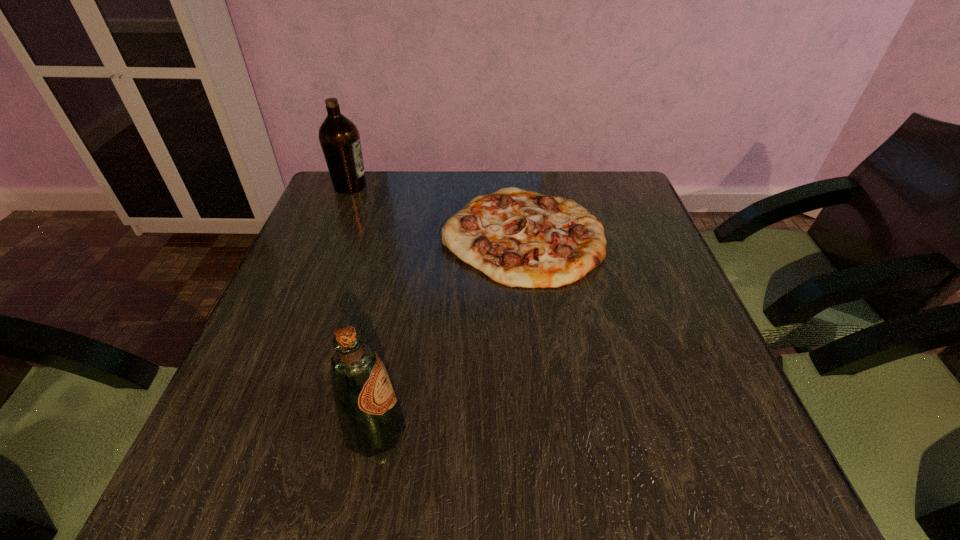
Image resolution: width=960 pixels, height=540 pixels. In the image, there is a desktop. Identify the location of free space at the far left corner. (336, 205).

The image size is (960, 540). In the image, there is a desktop. In order to click on free region at the far right corner in this screenshot , I will do (589, 188).

Locate an element on the screen. This screenshot has width=960, height=540. vacant space at the near right corner is located at coordinates (683, 467).

This screenshot has height=540, width=960. Identify the location of free space between the shortest object and the right olive oil. (449, 333).

This screenshot has width=960, height=540. Identify the location of vacant region between the second object from right to left and the pizza. (449, 333).

You are a GUI agent. You are given a task and a screenshot of the screen. Output one action in this format:
    pyautogui.click(x=<x>, y=<y>)
    Task: Click on the free space that is in between the shortest object and the right olive oil
    This screenshot has height=540, width=960.
    Given the screenshot: What is the action you would take?
    pyautogui.click(x=449, y=333)

The width and height of the screenshot is (960, 540). Identify the location of free spot between the right olive oil and the leftmost object. (363, 308).

Identify the location of free space between the farther olive oil and the shortest object. The width and height of the screenshot is (960, 540). (437, 210).

Find the location of a particular element. The width and height of the screenshot is (960, 540). free space that is in between the second object from left to right and the rightmost object is located at coordinates click(x=449, y=333).

Locate an element on the screen. free area in between the nearest object and the leftmost object is located at coordinates (363, 308).